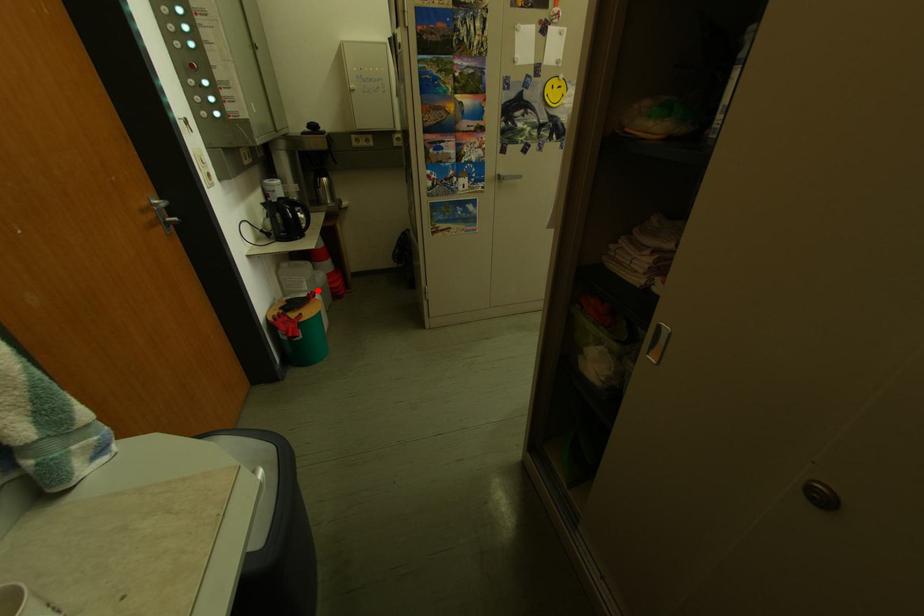
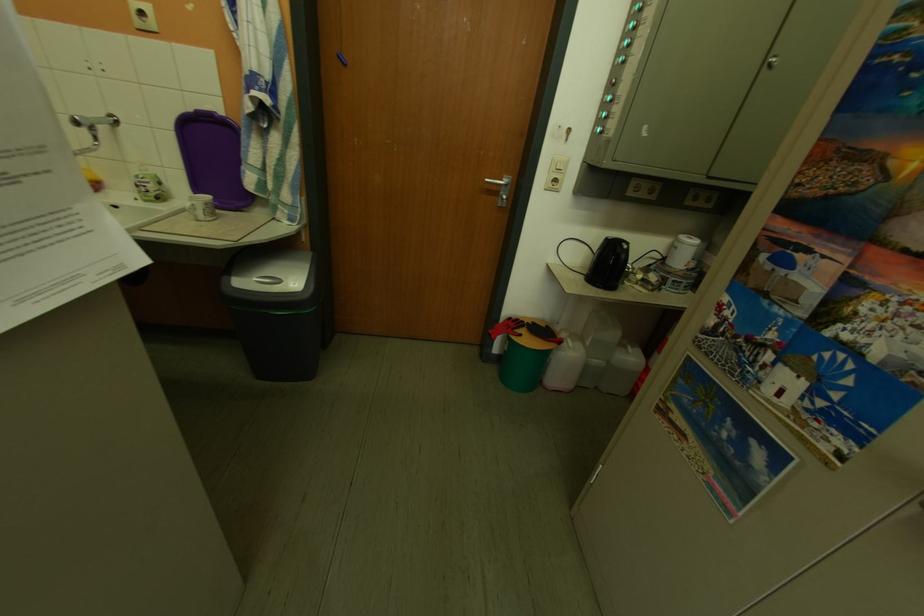
Find the pixel in the second image that matches the highlighted location in the first image.

(602, 346)